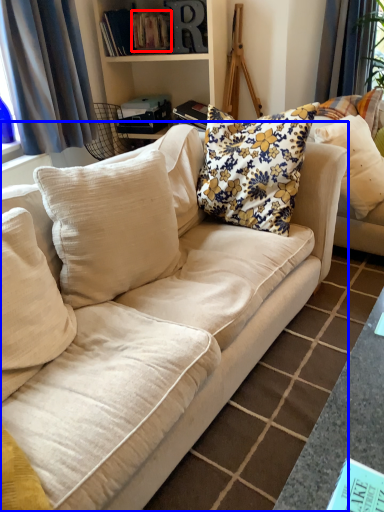
Question: Which point is closer to the camera, book (highlighted by a red box) or studio couch (highlighted by a blue box)?

Choices:
 (A) book
 (B) studio couch

Answer: (B)